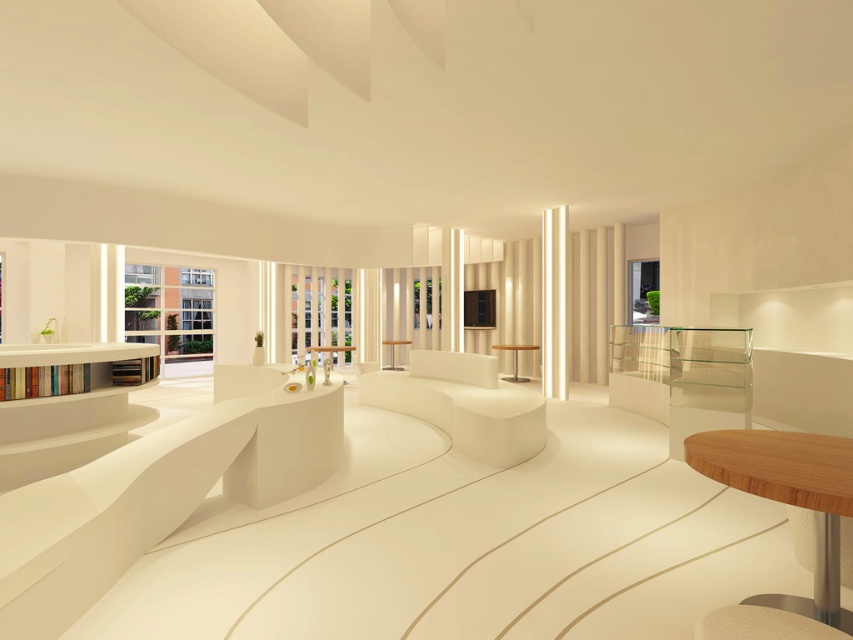
You are standing in the room and want to place a 1.5 meter long sofa in the central seating area. Considering the space between the light brown wooden table at lower right and your current position, will the sofa fit comfortably without being too cramped?

The distance between you and the light brown wooden table at lower right is 1.73 meters. Since the sofa is 1.5 meters long, there is enough space for it to fit comfortably without being cramped.

You are a delivery person carrying a large package that requires a flat surface to place. You see the wooden table at center and the matte white table at center. Which table should you choose to place the package?

The wooden table at center and the matte white table at center are two separate tables with a distance of 2.84 meters between them. Since both are tables, you can choose either one based on their surface size and stability, but the description does not provide information about their surface dimensions. However, the question specifies needing a flat surface, and both tables are likely flat. Please check the surface size of each table to ensure it can accommodate the package.